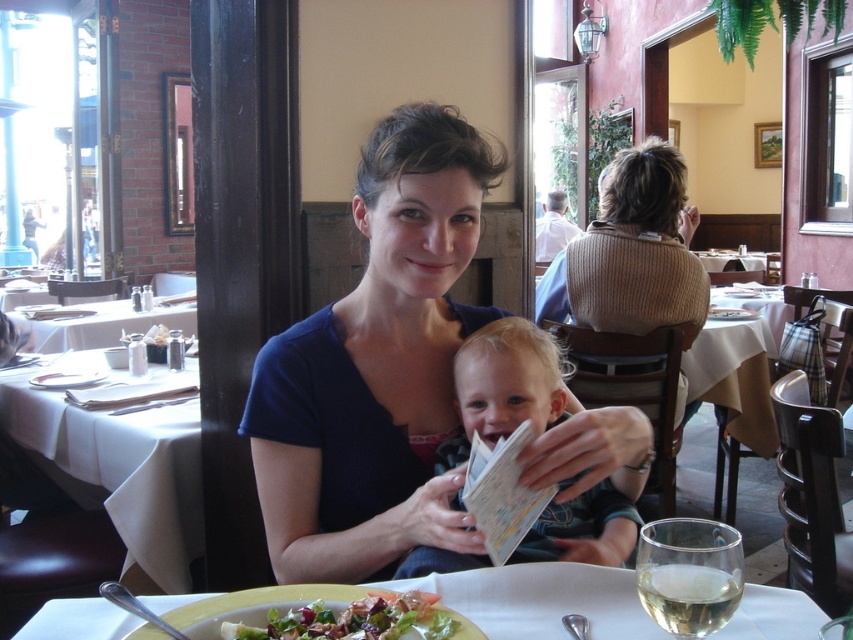
From the picture: You are a customer in the restaurant and you see the point at coordinates (376, 368). Which object is this point located on?

The point at coordinates (376, 368) is located on the matte blue shirt at center.

You are a delivery person who needs to place a small package on the table where the fresh green salad at lower center is located. There is also a knitted beige sweater at upper right on the same table. Can the package fit between them without moving either item?

The knitted beige sweater at upper right might be wider than the fresh green salad at lower center, so there may not be enough space between them for the package. It is recommended to check the available space before placing the package.